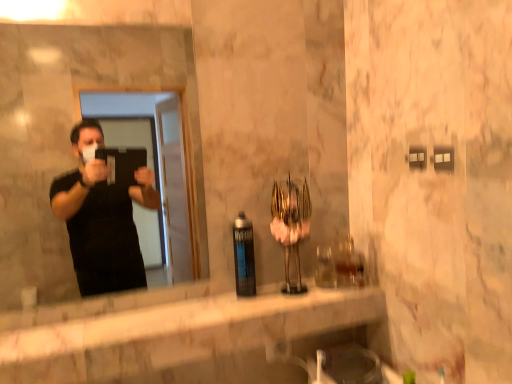
Question: From the image's perspective, is matte black mirror at left beneath matte black spray can at center?

Choices:
 (A) no
 (B) yes

Answer: (A)

Question: Is matte black mirror at left further to the viewer compared to matte black spray can at center?

Choices:
 (A) yes
 (B) no

Answer: (B)

Question: From a real-world perspective, does matte black mirror at left sit lower than matte black spray can at center?

Choices:
 (A) yes
 (B) no

Answer: (B)

Question: Is matte black mirror at left at the left side of matte black spray can at center?

Choices:
 (A) yes
 (B) no

Answer: (A)

Question: Considering the relative sizes of matte black mirror at left and matte black spray can at center in the image provided, is matte black mirror at left bigger than matte black spray can at center?

Choices:
 (A) no
 (B) yes

Answer: (B)

Question: Considering the positions of point (202, 244) and point (54, 327), is point (202, 244) closer or farther from the camera than point (54, 327)?

Choices:
 (A) closer
 (B) farther

Answer: (B)

Question: Is matte black mirror at left taller or shorter than white marble counter at center?

Choices:
 (A) tall
 (B) short

Answer: (A)

Question: From a real-world perspective, is matte black mirror at left positioned above or below white marble counter at center?

Choices:
 (A) below
 (B) above

Answer: (B)

Question: Considering their positions, is matte black mirror at left located in front of or behind white marble counter at center?

Choices:
 (A) behind
 (B) front

Answer: (A)

Question: Would you say matte black spray can at center is inside or outside matte black mirror at left?

Choices:
 (A) outside
 (B) inside

Answer: (A)

Question: Considering the positions of point (250, 223) and point (69, 284), is point (250, 223) closer or farther from the camera than point (69, 284)?

Choices:
 (A) closer
 (B) farther

Answer: (A)

Question: From the image's perspective, is matte black spray can at center positioned above or below matte black mirror at left?

Choices:
 (A) above
 (B) below

Answer: (B)

Question: Considering the positions of matte black spray can at center and matte black mirror at left in the image, is matte black spray can at center bigger or smaller than matte black mirror at left?

Choices:
 (A) small
 (B) big

Answer: (A)

Question: Is white marble counter at center taller or shorter than matte black spray can at center?

Choices:
 (A) tall
 (B) short

Answer: (B)

Question: Is white marble counter at center inside or outside of matte black spray can at center?

Choices:
 (A) inside
 (B) outside

Answer: (B)